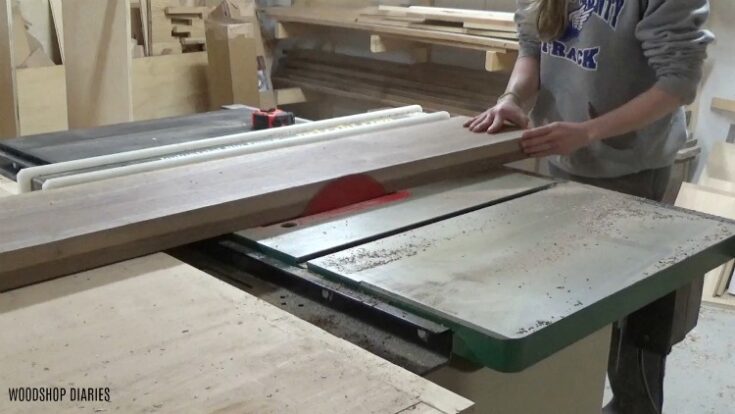
Where is `floor`? This screenshot has height=414, width=735. floor is located at coordinates (700, 381).